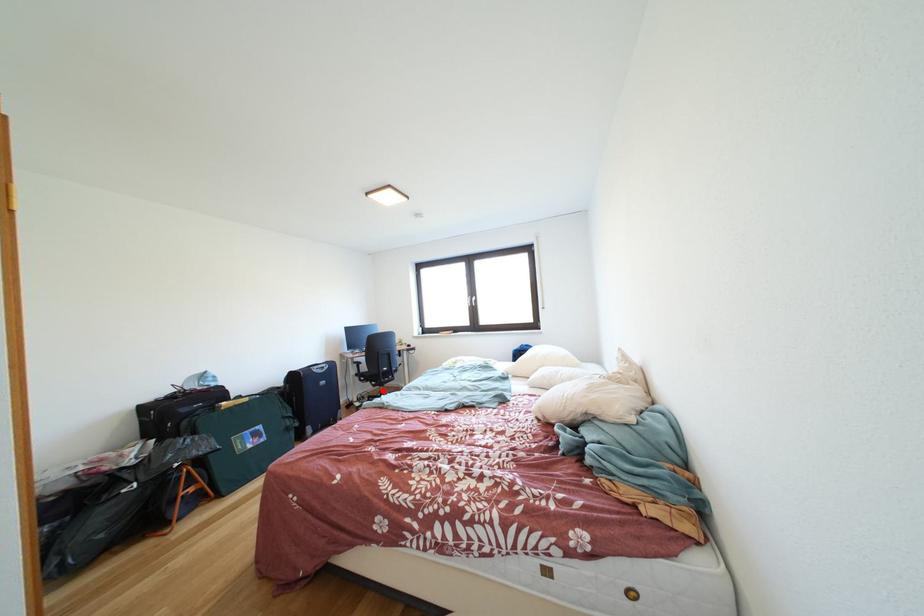
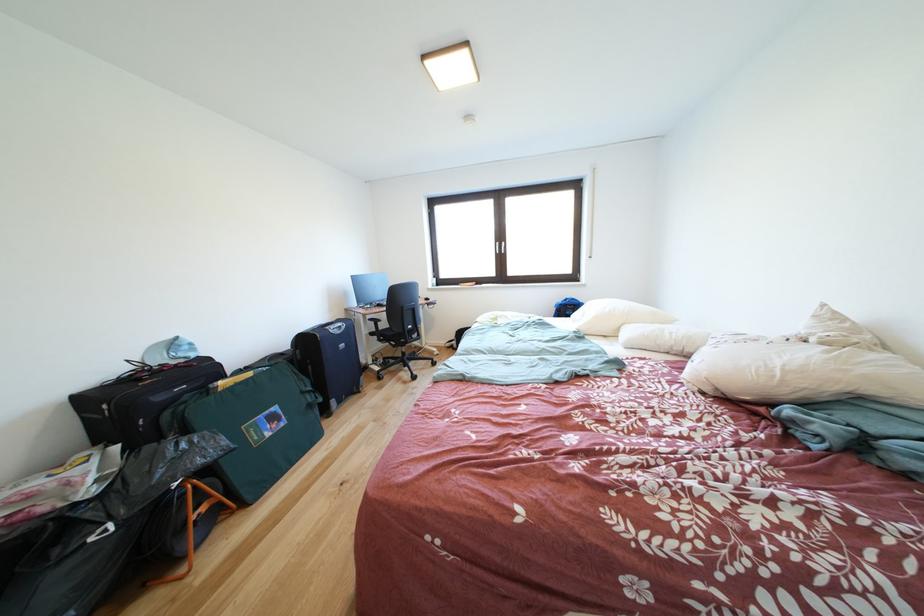
The point at the highlighted location is marked in the first image. Where is the corresponding point in the second image?

(403, 351)